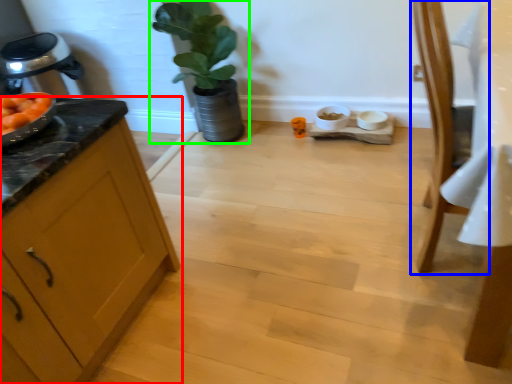
Question: Which object is positioned closest to cabinetry (highlighted by a red box)? Select from chair (highlighted by a blue box) and houseplant (highlighted by a green box).

Choices:
 (A) chair
 (B) houseplant

Answer: (A)